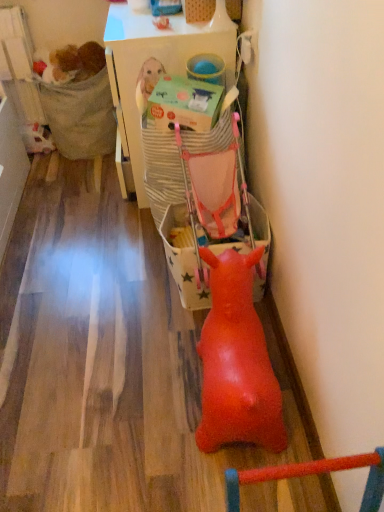
Locate an element on the screen. The image size is (384, 512). vacant space to the left of matte pink baby carriage at center is located at coordinates (124, 287).